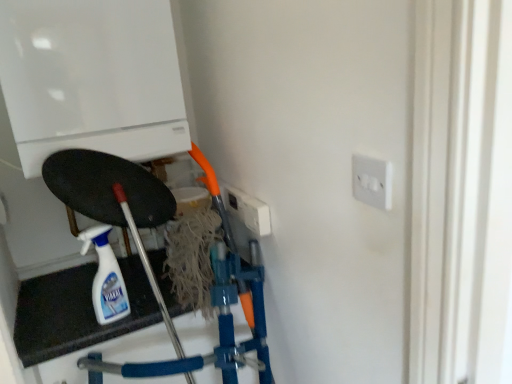
Question: Is white plastic socket at upper right surrounding white glossy boiler at upper left?

Choices:
 (A) yes
 (B) no

Answer: (B)

Question: From the image's perspective, is white plastic socket at upper right beneath white glossy boiler at upper left?

Choices:
 (A) no
 (B) yes

Answer: (B)

Question: Can you confirm if white plastic socket at upper right is smaller than white glossy boiler at upper left?

Choices:
 (A) no
 (B) yes

Answer: (B)

Question: Is white plastic socket at upper right directly adjacent to white glossy boiler at upper left?

Choices:
 (A) no
 (B) yes

Answer: (A)

Question: Does white plastic socket at upper right have a greater height compared to white glossy boiler at upper left?

Choices:
 (A) no
 (B) yes

Answer: (A)

Question: Is white glossy boiler at upper left inside the boundaries of white glossy spray bottle at lower left, or outside?

Choices:
 (A) inside
 (B) outside

Answer: (B)

Question: From the image's perspective, is white glossy boiler at upper left above or below white glossy spray bottle at lower left?

Choices:
 (A) below
 (B) above

Answer: (B)

Question: Is white glossy boiler at upper left in front of or behind white glossy spray bottle at lower left in the image?

Choices:
 (A) behind
 (B) front

Answer: (B)

Question: From a real-world perspective, relative to white glossy spray bottle at lower left, is white glossy boiler at upper left vertically above or below?

Choices:
 (A) below
 (B) above

Answer: (B)

Question: Considering the positions of point tap(353, 190) and point tap(108, 276), is point tap(353, 190) closer or farther from the camera than point tap(108, 276)?

Choices:
 (A) farther
 (B) closer

Answer: (B)

Question: In the image, is white plastic socket at upper right positioned in front of or behind white glossy spray bottle at lower left?

Choices:
 (A) front
 (B) behind

Answer: (A)

Question: Is white plastic socket at upper right spatially inside white glossy spray bottle at lower left, or outside of it?

Choices:
 (A) inside
 (B) outside

Answer: (B)

Question: In terms of size, does white plastic socket at upper right appear bigger or smaller than white glossy spray bottle at lower left?

Choices:
 (A) big
 (B) small

Answer: (B)

Question: Relative to white plastic socket at upper right, is white glossy spray bottle at lower left in front or behind?

Choices:
 (A) front
 (B) behind

Answer: (B)

Question: From a real-world perspective, is white glossy spray bottle at lower left above or below white plastic socket at upper right?

Choices:
 (A) above
 (B) below

Answer: (B)